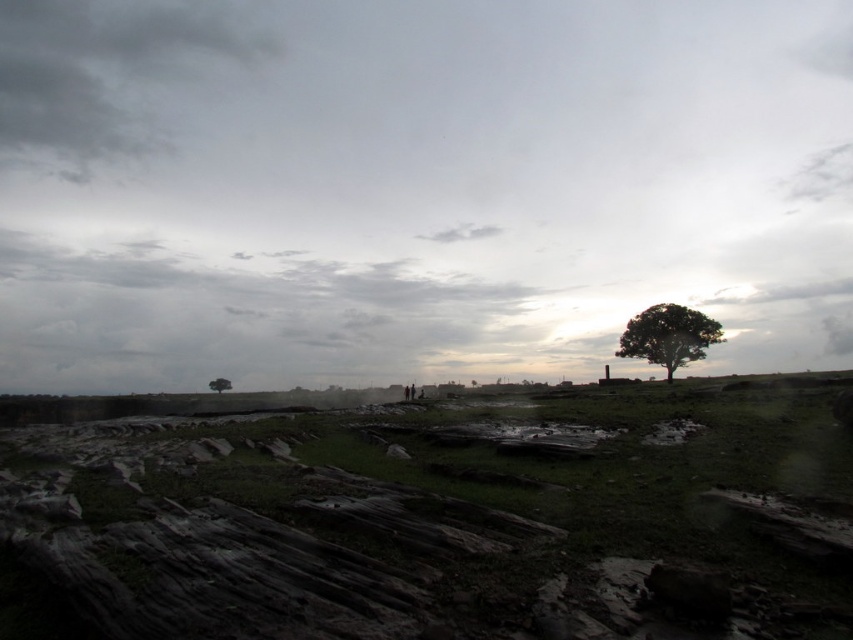
Question: Is muddy stone at center to the right of dark gray cloud at upper left from the viewer's perspective?

Choices:
 (A) no
 (B) yes

Answer: (B)

Question: Estimate the real-world distances between objects in this image. Which object is closer to the green leafy tree at right?

Choices:
 (A) dark gray cloud at upper left
 (B) green matte tree at lower center
 (C) muddy stone at center

Answer: (C)

Question: Does muddy stone at center lie behind green matte tree at lower center?

Choices:
 (A) yes
 (B) no

Answer: (B)

Question: Is the position of muddy stone at center less distant than that of green matte tree at lower center?

Choices:
 (A) no
 (B) yes

Answer: (B)

Question: Which point is farther to the camera?

Choices:
 (A) (224, 388)
 (B) (683, 321)

Answer: (A)

Question: Which object is farther from the camera taking this photo?

Choices:
 (A) green leafy tree at right
 (B) green matte tree at lower center
 (C) dark gray cloud at upper left
 (D) muddy stone at center

Answer: (C)